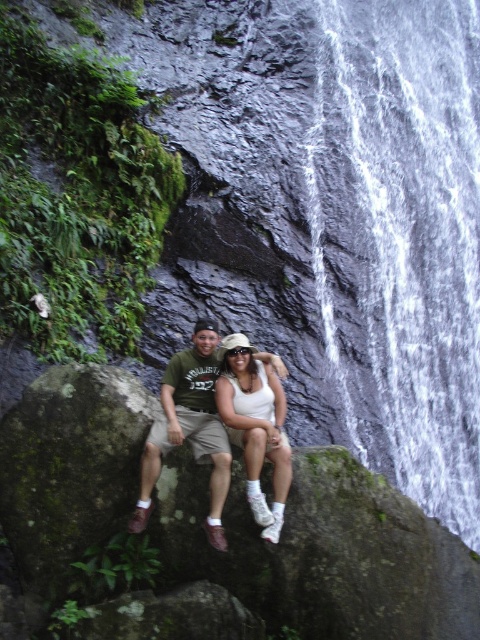
Can you confirm if matte khaki shorts at center is thinner than white matte tank top at center?

In fact, matte khaki shorts at center might be wider than white matte tank top at center.

Who is more distant from viewer, (x=196, y=323) or (x=282, y=467)?

Point (x=196, y=323)

I want to click on matte khaki shorts at center, so click(x=190, y=428).

Between point (358, 38) and point (267, 422), which one is positioned in front?

Point (267, 422)

Between white frothy water at center and white matte tank top at center, which one appears on the right side from the viewer's perspective?

white frothy water at center is more to the right.

Between point (344, 211) and point (274, 404), which one is positioned behind?

Positioned behind is point (344, 211).

You are a GUI agent. You are given a task and a screenshot of the screen. Output one action in this format:
    pyautogui.click(x=<x>, y=<y>)
    Task: Click on the white frothy water at center
    
    Given the screenshot: What is the action you would take?
    pyautogui.click(x=405, y=230)

Based on the photo, is white frothy water at center to the right of matte khaki shorts at center from the viewer's perspective?

Correct, you'll find white frothy water at center to the right of matte khaki shorts at center.

Based on the photo, is white frothy water at center bigger than matte khaki shorts at center?

Yes, white frothy water at center is bigger than matte khaki shorts at center.

Where is `white frothy water at center`? white frothy water at center is located at coordinates (405, 230).